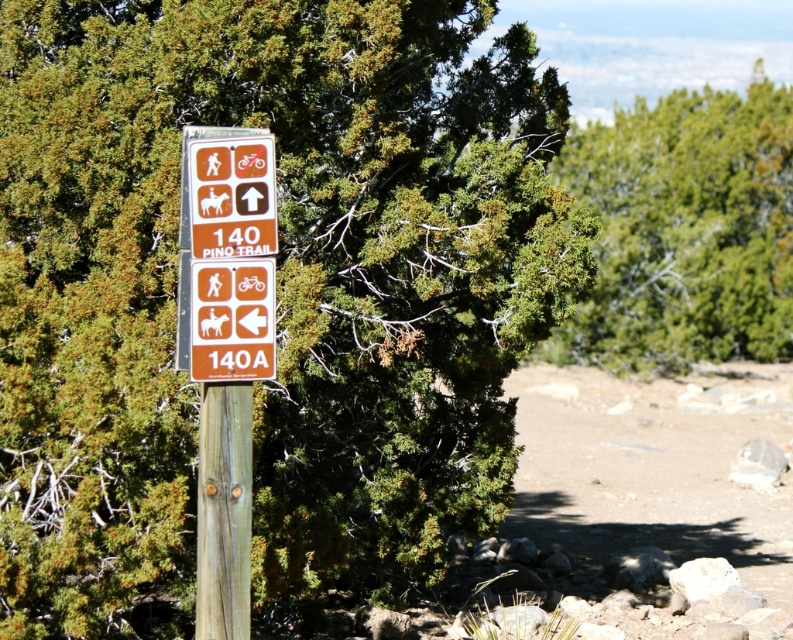
Question: Where is green leafy tree at upper center located in relation to orange matte sign at center in the image?

Choices:
 (A) left
 (B) right

Answer: (B)

Question: Can you confirm if green leafy tree at upper center is positioned to the right of brown wood post at center?

Choices:
 (A) no
 (B) yes

Answer: (B)

Question: Which object is farther from the camera taking this photo?

Choices:
 (A) brown wood post at center
 (B) orange matte sign at center

Answer: (B)

Question: Which point appears farthest from the camera in this image?

Choices:
 (A) (776, 273)
 (B) (232, 300)

Answer: (A)

Question: Among these objects, which one is farthest from the camera?

Choices:
 (A) green leafy tree at upper center
 (B) brown wood post at center
 (C) orange matte sign at center

Answer: (A)

Question: Is green leafy tree at upper center smaller than brown wood post at center?

Choices:
 (A) no
 (B) yes

Answer: (A)